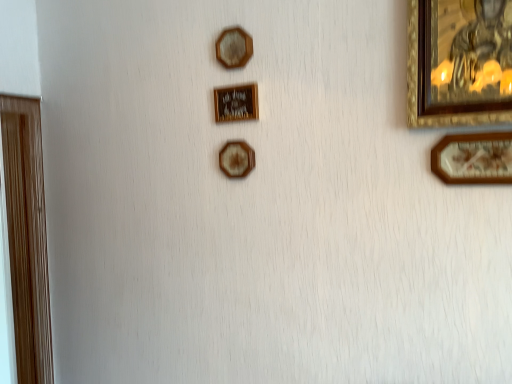
Question: Considering the relative sizes of wooden picture frame at right, which is the first picture frame from right to left, and wooden door at left, acting as the 6th picture frame starting from the right, in the image provided, is wooden picture frame at right, which is the first picture frame from right to left, wider than wooden door at left, acting as the 6th picture frame starting from the right,?

Choices:
 (A) no
 (B) yes

Answer: (A)

Question: Is wooden picture frame at right, which is the first picture frame from right to left, taller than wooden door at left, acting as the 6th picture frame starting from the right?

Choices:
 (A) no
 (B) yes

Answer: (A)

Question: From the image's perspective, would you say wooden picture frame at right, which is the first picture frame from right to left, is positioned over wooden door at left, positioned as the sixth picture frame in front-to-back order?

Choices:
 (A) no
 (B) yes

Answer: (B)

Question: Is wooden picture frame at right, which is the sixth picture frame in back-to-front order, placed right next to wooden door at left, acting as the 6th picture frame starting from the right?

Choices:
 (A) yes
 (B) no

Answer: (B)

Question: Can you confirm if wooden picture frame at right, marked as the 6th picture frame in a left-to-right arrangement, is positioned to the right of wooden door at left, positioned as the sixth picture frame in front-to-back order?

Choices:
 (A) yes
 (B) no

Answer: (A)

Question: Is gold-framed painting at upper right, arranged as the 2th picture frame when viewed from the right, in front of or behind wooden hexagon at center, the 3th picture frame positioned from the left, in the image?

Choices:
 (A) front
 (B) behind

Answer: (A)

Question: From the image's perspective, relative to wooden hexagon at center, marked as the fifth picture frame in a front-to-back arrangement, is gold-framed painting at upper right, which ranks as the 5th picture frame in back-to-front order, above or below?

Choices:
 (A) above
 (B) below

Answer: (A)

Question: Is gold-framed painting at upper right, arranged as the 2th picture frame when viewed from the right, bigger or smaller than wooden hexagon at center, the 3th picture frame positioned from the left?

Choices:
 (A) small
 (B) big

Answer: (B)

Question: From a real-world perspective, is gold-framed painting at upper right, arranged as the fifth picture frame when viewed from the left, above or below wooden hexagon at center, the fourth picture frame from the right?

Choices:
 (A) above
 (B) below

Answer: (A)

Question: From a real-world perspective, is wooden picture frame at right, which is the sixth picture frame in back-to-front order, physically located above or below gold-framed painting at upper right, the 2th picture frame when ordered from front to back?

Choices:
 (A) below
 (B) above

Answer: (A)

Question: From their relative heights in the image, would you say wooden picture frame at right, the first picture frame in the front-to-back sequence, is taller or shorter than gold-framed painting at upper right, arranged as the fifth picture frame when viewed from the left?

Choices:
 (A) short
 (B) tall

Answer: (A)

Question: Looking at their shapes, would you say wooden picture frame at right, the first picture frame in the front-to-back sequence, is wider or thinner than gold-framed painting at upper right, arranged as the fifth picture frame when viewed from the left?

Choices:
 (A) wide
 (B) thin

Answer: (B)

Question: Considering the relative positions of wooden picture frame at right, the first picture frame in the front-to-back sequence, and gold-framed painting at upper right, the 2th picture frame when ordered from front to back, in the image provided, is wooden picture frame at right, the first picture frame in the front-to-back sequence, to the left or to the right of gold-framed painting at upper right, the 2th picture frame when ordered from front to back,?

Choices:
 (A) right
 (B) left

Answer: (A)

Question: Considering their positions, is wooden hexagon at upper center, positioned as the second picture frame in left-to-right order, located in front of or behind gold metallic picture frame at center, the 4th picture frame from the left?

Choices:
 (A) front
 (B) behind

Answer: (A)

Question: Considering the positions of wooden hexagon at upper center, the 3th picture frame when ordered from front to back, and gold metallic picture frame at center, marked as the fourth picture frame in a front-to-back arrangement, in the image, is wooden hexagon at upper center, the 3th picture frame when ordered from front to back, wider or thinner than gold metallic picture frame at center, marked as the fourth picture frame in a front-to-back arrangement,?

Choices:
 (A) thin
 (B) wide

Answer: (B)